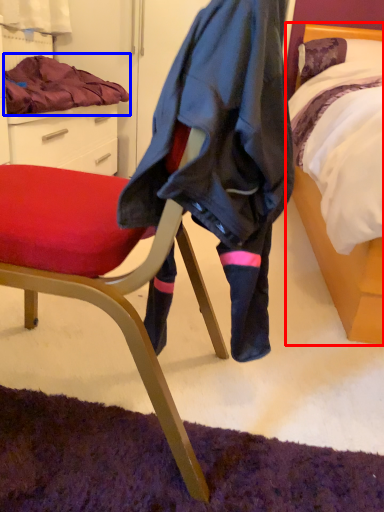
Question: Which object appears closest to the camera in this image, bed (highlighted by a red box) or blanket (highlighted by a blue box)?

Choices:
 (A) bed
 (B) blanket

Answer: (A)